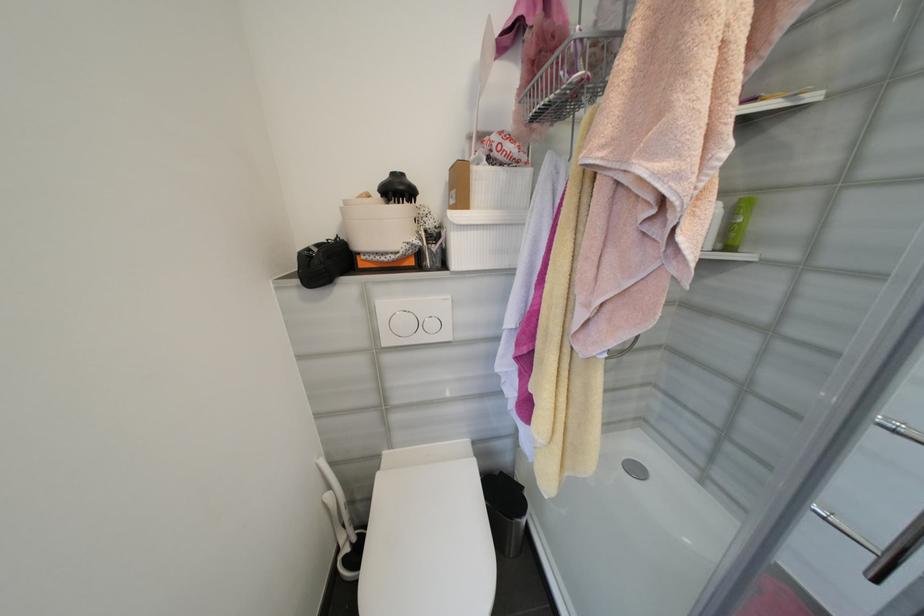
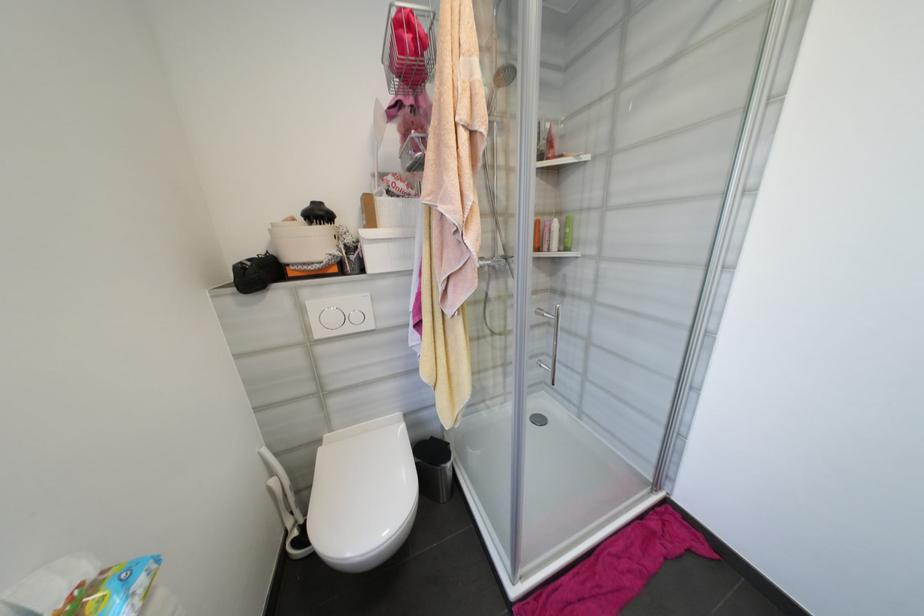
Locate, in the second image, the point that corresponds to point 651,422 in the first image.

(552, 384)